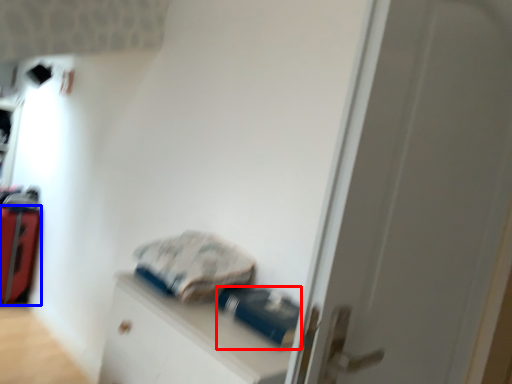
Question: Which of the following is the closest to the observer, equipment (highlighted by a red box) or luggage (highlighted by a blue box)?

Choices:
 (A) equipment
 (B) luggage

Answer: (A)